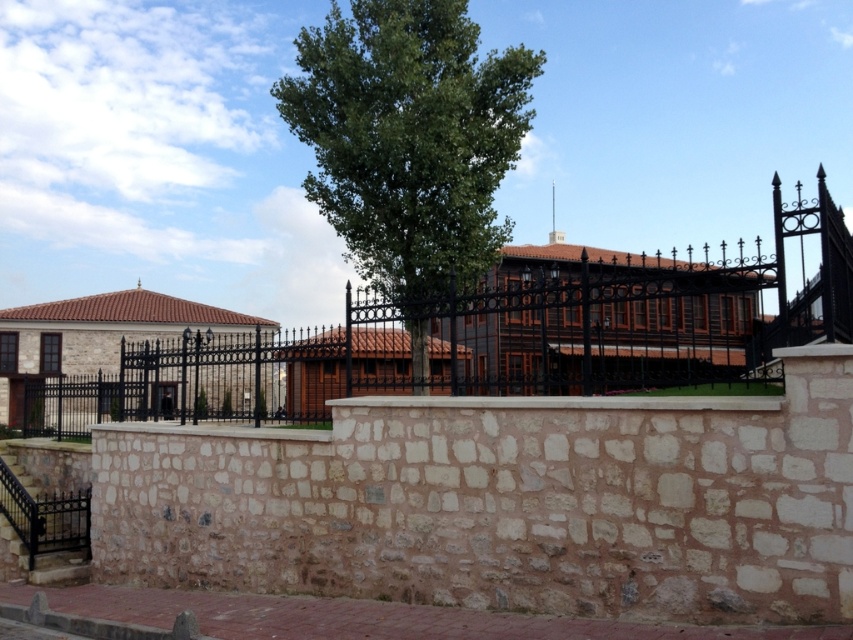
You are a painter standing at the base of the stone wall and want to paint both the black wrought iron fence at center and the green leafy tree at center. Which object will you need to tilt your head upwards more to see the top of?

The green leafy tree at center requires tilting your head upwards more because it is taller than the black wrought iron fence at center.

You are standing in front of the stone wall and want to walk through the open gate at the end of the black wrought iron fence at center. Since the green leafy tree at center is behind the fence, will the tree block your view of the gate?

The black wrought iron fence at center is in front of the green leafy tree at center, so the tree will not block your view of the gate because the fence is closer to you than the tree.